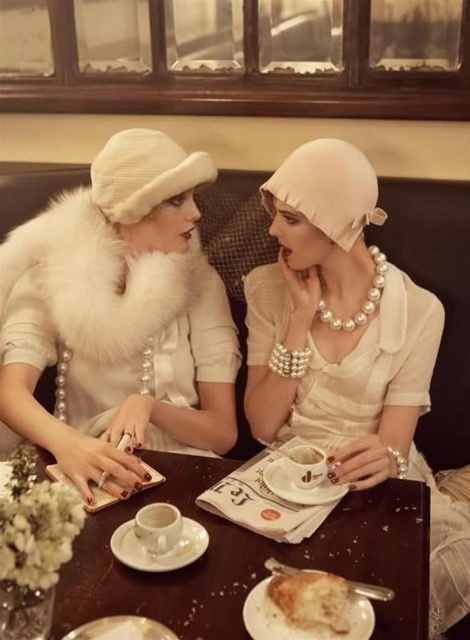
You are a photographer setting up a shot of the two women at the vintage cafe. You need to ensure that the white fur collar at center and the wooden table at center are both in focus. Which object should you focus on first to ensure both are sharp?

The white fur collar at center is located above the wooden table at center, so you should focus on the wooden table at center first since it is closer to the camera, ensuring both objects will be in focus.

You are a photographer standing in front of the wooden table at center and the golden brown crusty bread at lower center. You want to take a photo of both objects but your camera can only focus on objects that are closer to you. Which object should you choose to ensure the photo is in focus?

The wooden table at center is closer to the viewer than the golden brown crusty bread at lower center, so you should choose the wooden table at center to ensure the photo is in focus.